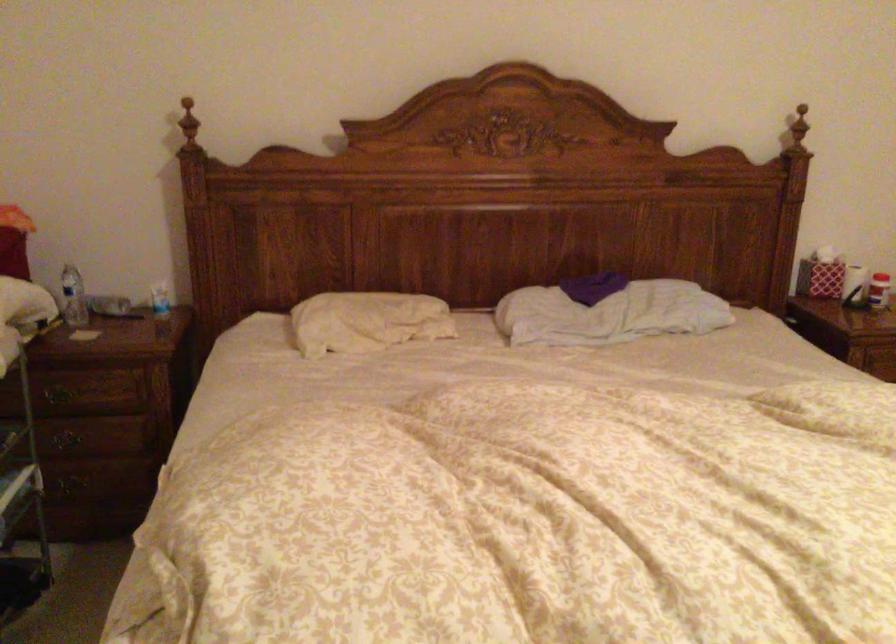
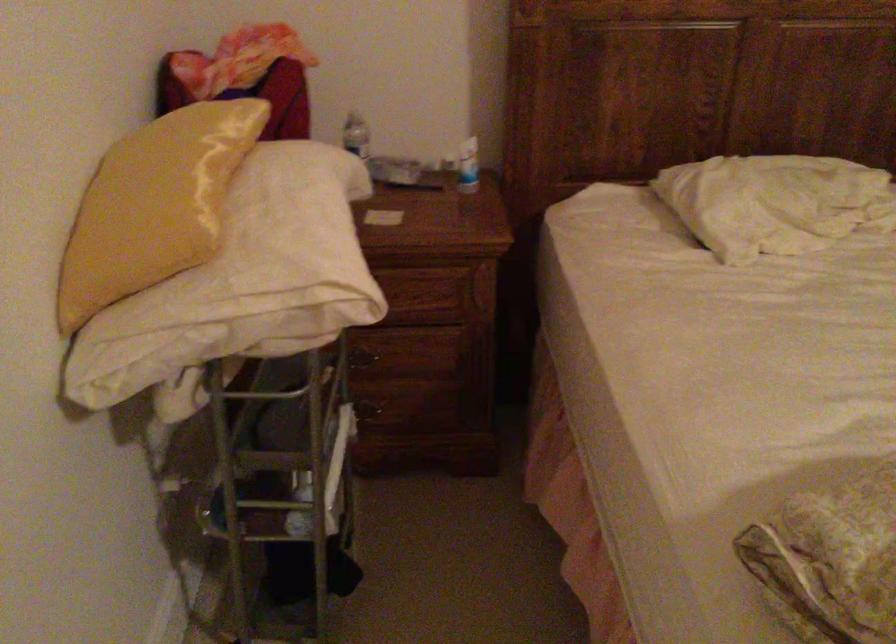
Where in the second image is the point corresponding to the point at 350,322 from the first image?

(774, 202)